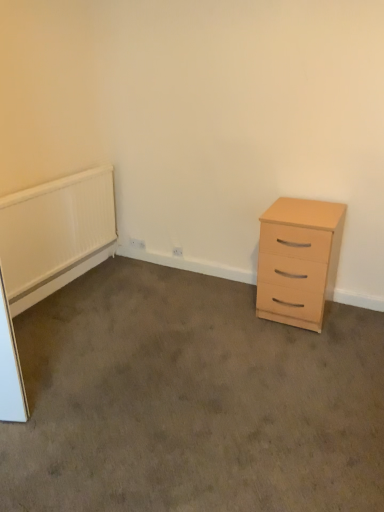
Question: Is white plastic electric outlet at lower center bigger or smaller than light wood/finish chest of drawers at right?

Choices:
 (A) small
 (B) big

Answer: (A)

Question: Is white plastic electric outlet at lower center spatially inside light wood/finish chest of drawers at right, or outside of it?

Choices:
 (A) outside
 (B) inside

Answer: (A)

Question: Which is nearer to the light wood drawer at right?

Choices:
 (A) white textured radiator at left
 (B) white plastic electric outlet at lower center
 (C) light wood/finish chest of drawers at right

Answer: (C)

Question: Considering the real-world distances, which object is closest to the light wood drawer at right?

Choices:
 (A) white plastic electric outlet at lower center
 (B) light wood/finish chest of drawers at right
 (C) white textured radiator at left

Answer: (B)